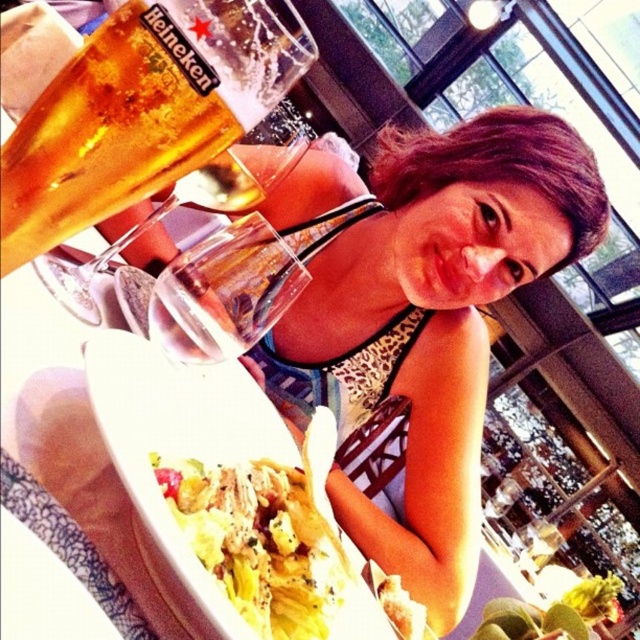
Question: Can you confirm if yellow crisp lettuce at lower center is smaller than clear glass wine glass at upper left?

Choices:
 (A) yes
 (B) no

Answer: (A)

Question: Among these objects, which one is nearest to the camera?

Choices:
 (A) leopard print bikini top at center
 (B) golden amber liquid at upper left
 (C) clear glass wine glass at upper left

Answer: (B)

Question: Which point appears farthest from the camera in this image?

Choices:
 (A) (333, 563)
 (B) (388, 385)

Answer: (B)

Question: Which is farther from the yellow crisp lettuce at lower center?

Choices:
 (A) leopard print bikini top at center
 (B) golden amber liquid at upper left

Answer: (A)

Question: Where is yellow crisp lettuce at lower center located in relation to clear glass wine glass at upper left in the image?

Choices:
 (A) right
 (B) left

Answer: (A)

Question: Is golden amber liquid at upper left thinner than yellow crisp lettuce at lower center?

Choices:
 (A) no
 (B) yes

Answer: (A)